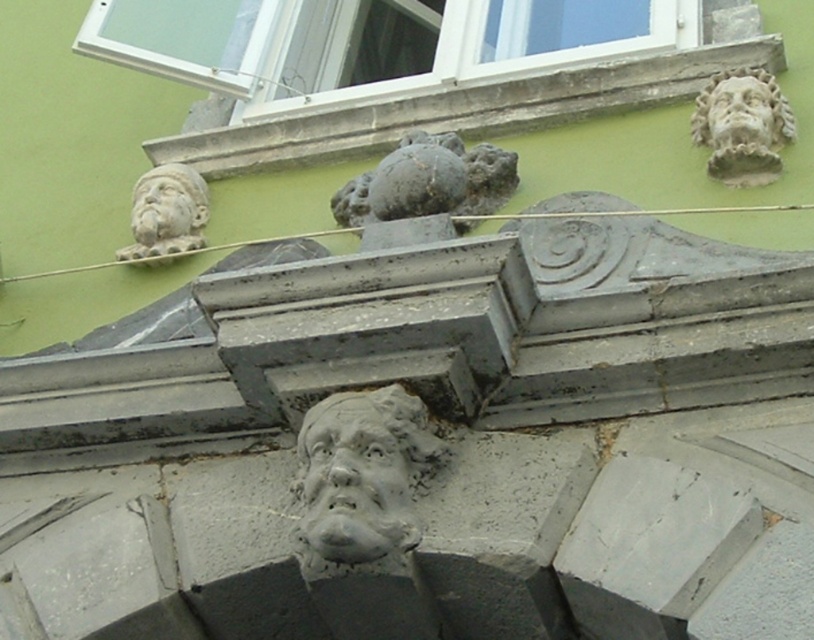
Does gray stone head at upper right appear on the left side of matte gray stone face at upper left?

In fact, gray stone head at upper right is to the right of matte gray stone face at upper left.

Between point (751, 99) and point (195, 216), which one is positioned in front?

Positioned in front is point (751, 99).

Locate an element on the screen. The height and width of the screenshot is (640, 814). gray stone head at upper right is located at coordinates (742, 125).

Does gray stone face at center have a greater height compared to gray stone head at upper right?

Incorrect, gray stone face at center's height is not larger of gray stone head at upper right's.

Can you confirm if gray stone face at center is smaller than gray stone head at upper right?

Incorrect, gray stone face at center is not smaller in size than gray stone head at upper right.

Does point (361, 506) lie behind point (694, 122)?

No, (361, 506) is in front of (694, 122).

Locate an element on the screen. Image resolution: width=814 pixels, height=640 pixels. gray stone face at center is located at coordinates (353, 483).

Find the location of a particular element. gray stone face at center is located at coordinates (353, 483).

Which of these two, gray stone face at center or gray stone face at upper right, stands shorter?

Standing shorter between the two is gray stone face at upper right.

Locate an element on the screen. The width and height of the screenshot is (814, 640). gray stone face at center is located at coordinates (353, 483).